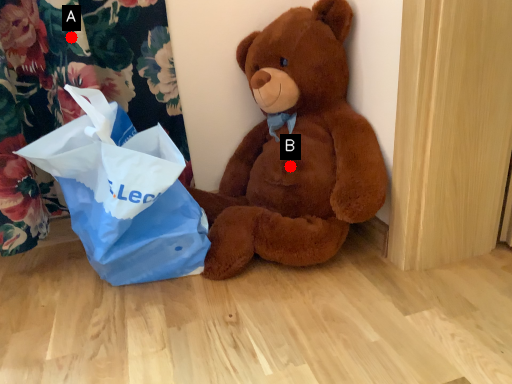
Question: Two points are circled on the image, labeled by A and B beside each circle. Which point is farther to the camera?

Choices:
 (A) A is further
 (B) B is further

Answer: (B)